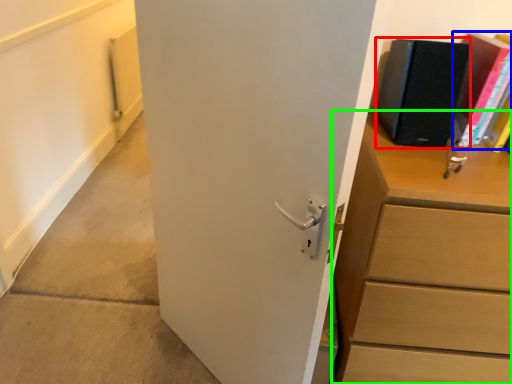
Question: Estimate the real-world distances between objects in this image. Which object is farther from paperback book (highlighted by a red box), paperback book (highlighted by a blue box) or chest of drawers (highlighted by a green box)?

Choices:
 (A) paperback book
 (B) chest of drawers

Answer: (B)